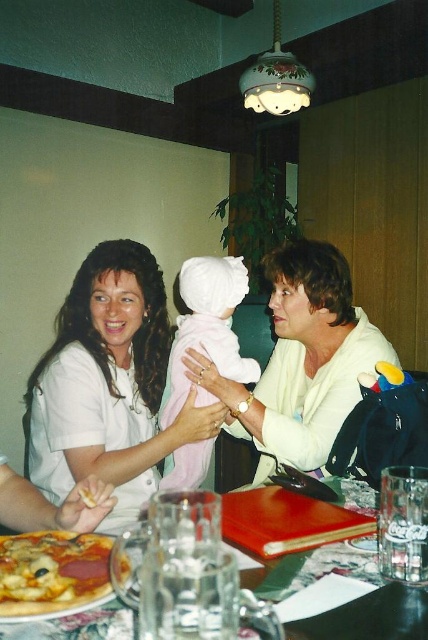
Does pink soft fabric baby at center lie behind golden crispy pizza at lower left?

Yes, pink soft fabric baby at center is further from the viewer.

Does pink soft fabric baby at center have a greater width compared to golden crispy pizza at lower left?

Correct, the width of pink soft fabric baby at center exceeds that of golden crispy pizza at lower left.

Is point (241, 369) farther from camera compared to point (107, 586)?

Yes.

Where is `pink soft fabric baby at center`? Image resolution: width=428 pixels, height=640 pixels. pink soft fabric baby at center is located at coordinates (208, 326).

In the scene shown: Is white matte shirt at center to the right of matte white sweater at center from the viewer's perspective?

In fact, white matte shirt at center is to the left of matte white sweater at center.

Between white matte shirt at center and matte white sweater at center, which one is positioned higher?

matte white sweater at center

This screenshot has height=640, width=428. I want to click on white matte shirt at center, so click(109, 385).

Is pink soft fabric baby at center to the right of matte plastic plate at lower left from the viewer's perspective?

No, pink soft fabric baby at center is not to the right of matte plastic plate at lower left.

Is point (235, 358) positioned before point (427, 632)?

That is False.

Is point (168, 388) in front of point (291, 625)?

No, (168, 388) is further to viewer.

The image size is (428, 640). Identify the location of pink soft fabric baby at center. (208, 326).